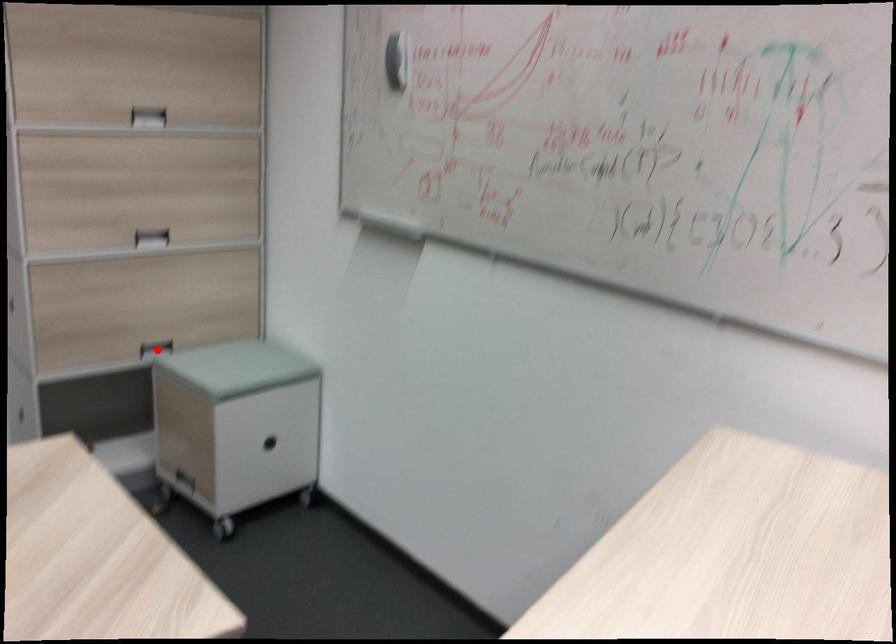
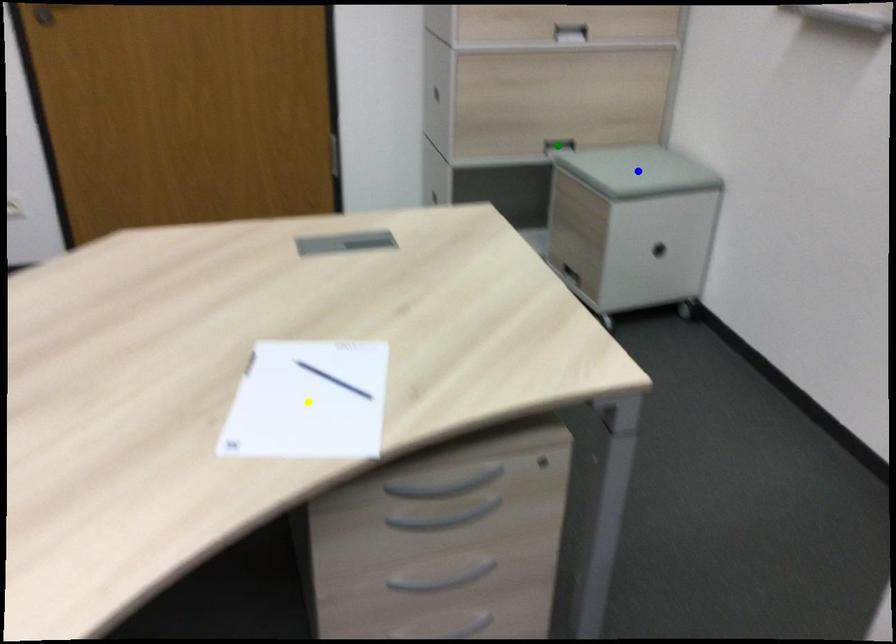
Question: I am providing you with two images of the same scene from different viewpoints. A red point is marked on the first image. You are given multiple points on the second image. Which point in image 2 is actually the same real-world point as the red point in image 1?

Choices:
 (A) yellow point
 (B) green point
 (C) blue point

Answer: (B)